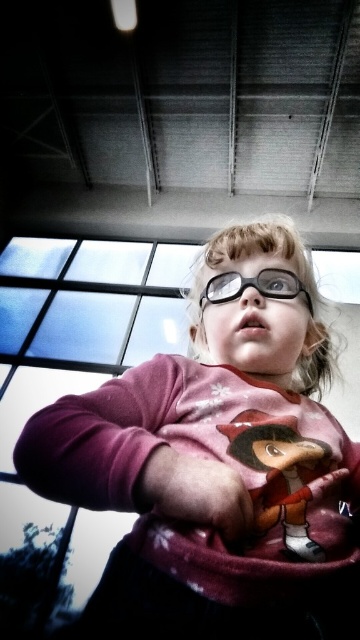
Question: Is matte pink plush toy at center to the right of black plastic glasses at center from the viewer's perspective?

Choices:
 (A) yes
 (B) no

Answer: (A)

Question: Is matte pink plush toy at center bigger than pink matte hand at center?

Choices:
 (A) no
 (B) yes

Answer: (B)

Question: Does pink matte sweater at center appear on the right side of matte pink plush toy at center?

Choices:
 (A) yes
 (B) no

Answer: (B)

Question: Which point appears closest to the camera in this image?

Choices:
 (A) pos(288,451)
 (B) pos(276,272)
 (C) pos(29,465)
 (D) pos(162,480)

Answer: (C)

Question: Considering the real-world distances, which object is farthest from the pink matte sweater at center?

Choices:
 (A) black plastic glasses at center
 (B) pink matte hand at center

Answer: (B)

Question: Among these points, which one is farthest from the camera?

Choices:
 (A) (335, 476)
 (B) (174, 452)

Answer: (A)